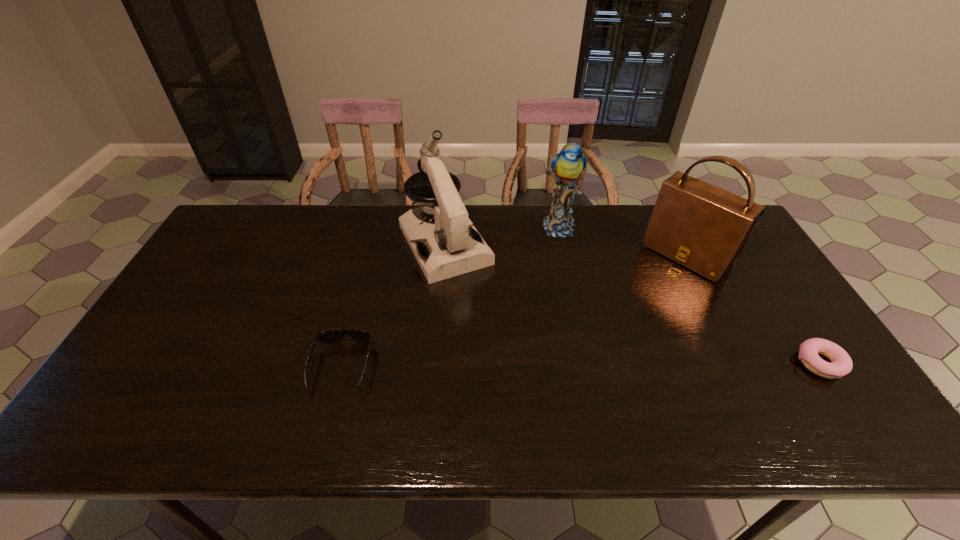
I want to click on free space on the desktop that is between the sunglasses and the rightmost object and is positioned at the eyepiece of the microscope, so (x=517, y=366).

Image resolution: width=960 pixels, height=540 pixels. What are the coordinates of `free space on the desktop that is between the sunglasses and the rightmost object and is positioned on the front flap of the fourth object from left to right` in the screenshot? It's located at (569, 365).

The image size is (960, 540). Find the location of `free space on the desktop that is between the fourth tallest object and the rightmost object and is positioned on the face of the third object from left to right`. free space on the desktop that is between the fourth tallest object and the rightmost object and is positioned on the face of the third object from left to right is located at coordinates (626, 364).